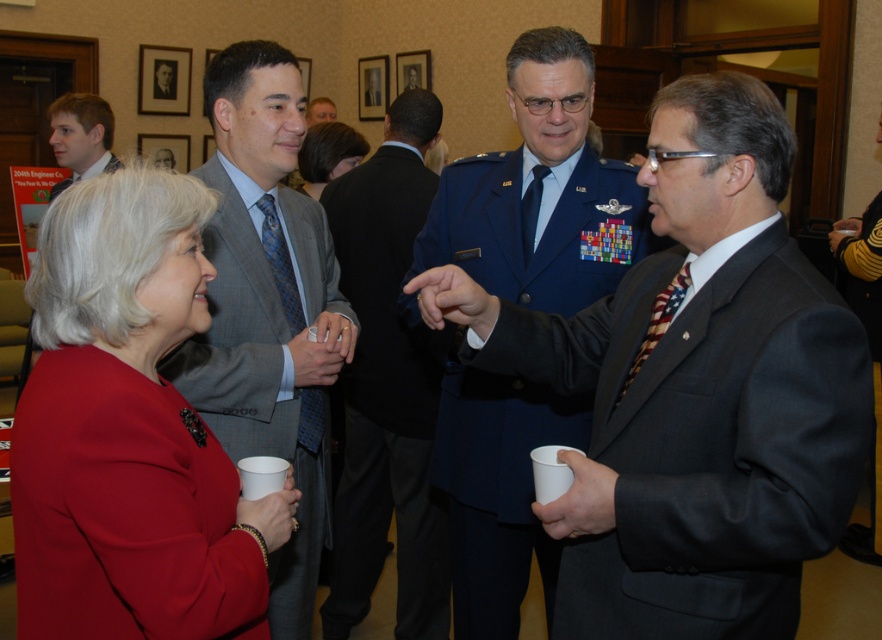
Question: Considering the relative positions of matte black suit at upper left and matte gray suit at upper left in the image provided, where is matte black suit at upper left located with respect to matte gray suit at upper left?

Choices:
 (A) below
 (B) above

Answer: (B)

Question: Which point appears farthest from the camera in this image?

Choices:
 (A) (367, 147)
 (B) (564, 285)
 (C) (60, 182)
 (D) (604, 513)

Answer: (C)

Question: Is matte gray suit at center above dark brown hair at center?

Choices:
 (A) no
 (B) yes

Answer: (A)

Question: Which object is the closest to the matte red blazer at center?

Choices:
 (A) matte gray suit at upper left
 (B) matte black suit at center

Answer: (A)

Question: Does matte red blazer at center appear on the right side of matte black suit at center?

Choices:
 (A) yes
 (B) no

Answer: (A)

Question: Which point is closer to the camera taking this photo?

Choices:
 (A) (873, 262)
 (B) (185, 205)
 (C) (290, 388)
 (D) (333, 104)

Answer: (B)